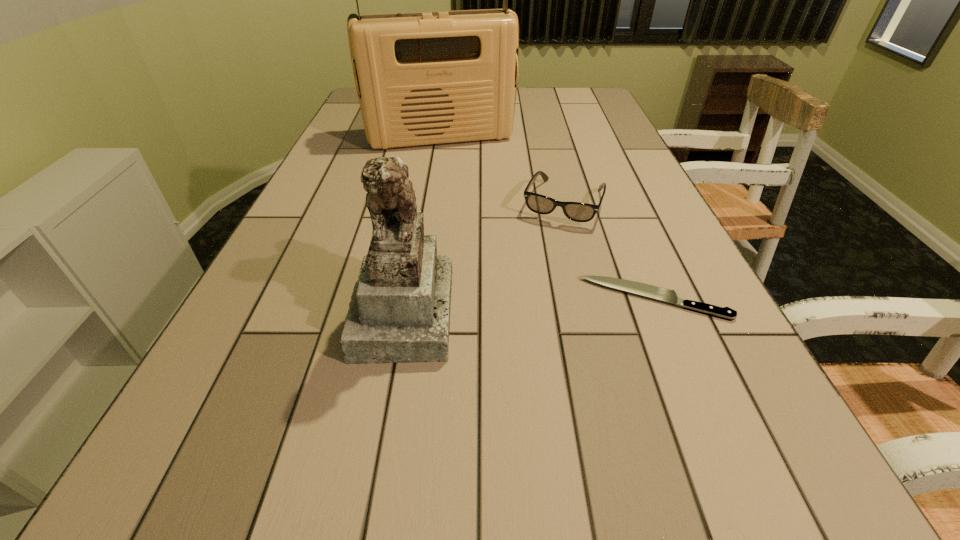
Find the location of a particular element. The height and width of the screenshot is (540, 960). vacant space situated on the front-facing side of the farthest object is located at coordinates (473, 208).

The height and width of the screenshot is (540, 960). What are the coordinates of `free location located 0.110m on the lenses of the spectacles` in the screenshot? It's located at (541, 257).

You are a GUI agent. You are given a task and a screenshot of the screen. Output one action in this format:
    pyautogui.click(x=<x>, y=<y>)
    Task: Click on the vacant region located 0.300m on the lenses of the spectacles
    The width and height of the screenshot is (960, 540).
    Given the screenshot: What is the action you would take?
    click(516, 318)

The width and height of the screenshot is (960, 540). Find the location of `vacant region located on the lenses of the spectacles`. vacant region located on the lenses of the spectacles is located at coordinates (505, 342).

The height and width of the screenshot is (540, 960). I want to click on object present at the left edge, so click(x=422, y=78).

Locate an element on the screen. The image size is (960, 540). steak knife located in the right edge section of the desktop is located at coordinates (671, 296).

At what (x,y) coordinates should I click in order to perform the action: click on spectacles that is at the right edge. Please return your answer as a coordinate pair (x, y). This screenshot has width=960, height=540. Looking at the image, I should click on (579, 212).

Image resolution: width=960 pixels, height=540 pixels. In the image, there is a desktop. What are the coordinates of `blank space at the near edge` in the screenshot? It's located at (511, 407).

In the image, there is a desktop. At what (x,y) coordinates should I click in order to perform the action: click on vacant space at the left edge. Please return your answer as a coordinate pair (x, y). This screenshot has width=960, height=540. Looking at the image, I should click on (335, 234).

Find the location of a particular element. The width and height of the screenshot is (960, 540). free location at the right edge is located at coordinates (618, 256).